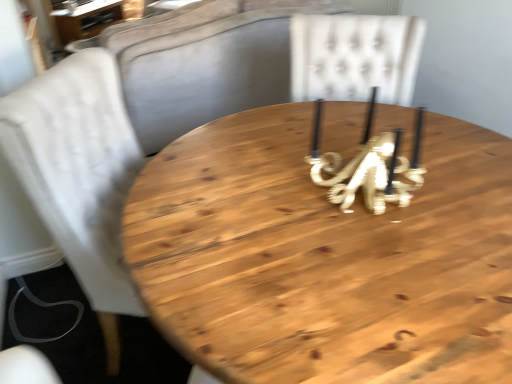
Question: Can you confirm if wooden table at upper left, acting as the 1th table starting from the left, is smaller than white fabric chair at left?

Choices:
 (A) no
 (B) yes

Answer: (B)

Question: Is wooden table at upper left, which ranks as the second table in front-to-back order, in contact with white fabric chair at left?

Choices:
 (A) no
 (B) yes

Answer: (A)

Question: Considering the relative sizes of wooden table at upper left, which ranks as the second table in bottom-to-top order, and white fabric chair at left in the image provided, is wooden table at upper left, which ranks as the second table in bottom-to-top order, bigger than white fabric chair at left?

Choices:
 (A) yes
 (B) no

Answer: (B)

Question: From a real-world perspective, is wooden table at upper left, the second table when ordered from right to left, on top of white fabric chair at left?

Choices:
 (A) yes
 (B) no

Answer: (B)

Question: Is wooden table at upper left, the second table when ordered from right to left, oriented towards white fabric chair at left?

Choices:
 (A) no
 (B) yes

Answer: (A)

Question: Is point (90, 24) positioned closer to the camera than point (197, 153)?

Choices:
 (A) closer
 (B) farther

Answer: (B)

Question: In the image, is wooden table at upper left, which is the 1th table in top-to-bottom order, on the left side or the right side of natural wood table at center, arranged as the 2th table when viewed from the back?

Choices:
 (A) left
 (B) right

Answer: (A)

Question: Looking at their shapes, would you say wooden table at upper left, which is the 1th table in top-to-bottom order, is wider or thinner than natural wood table at center, which appears as the 1th table when viewed from the front?

Choices:
 (A) wide
 (B) thin

Answer: (A)

Question: In the image, is wooden table at upper left, which is the 1th table in back-to-front order, positioned in front of or behind natural wood table at center, which appears as the 1th table when ordered from the bottom?

Choices:
 (A) behind
 (B) front

Answer: (A)

Question: From a real-world perspective, is wooden table at upper left, the second table when ordered from right to left, physically located above or below white fabric chair at left?

Choices:
 (A) above
 (B) below

Answer: (B)

Question: Is wooden table at upper left, which is the 1th table in back-to-front order, to the left or to the right of white fabric chair at left in the image?

Choices:
 (A) left
 (B) right

Answer: (A)

Question: Is point (77, 28) positioned closer to the camera than point (75, 231)?

Choices:
 (A) closer
 (B) farther

Answer: (B)

Question: Do you think wooden table at upper left, which is the 1th table in back-to-front order, is within white fabric chair at left, or outside of it?

Choices:
 (A) inside
 (B) outside

Answer: (B)

Question: In terms of width, does natural wood table at center, which ranks as the 2th table in left-to-right order, look wider or thinner when compared to wooden table at upper left, acting as the 1th table starting from the left?

Choices:
 (A) wide
 (B) thin

Answer: (B)

Question: In terms of size, does natural wood table at center, which ranks as the 2th table in left-to-right order, appear bigger or smaller than wooden table at upper left, which is the 1th table in top-to-bottom order?

Choices:
 (A) small
 (B) big

Answer: (B)